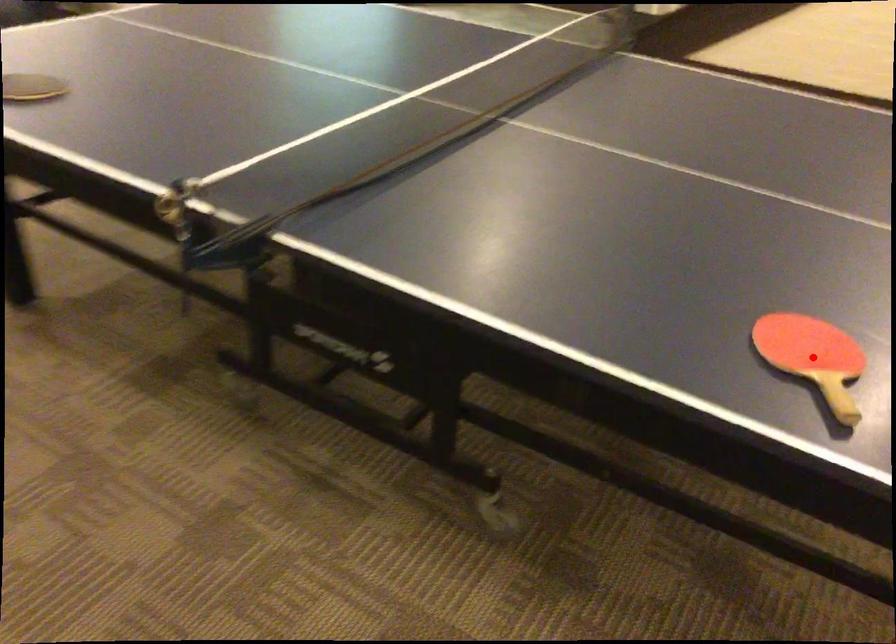
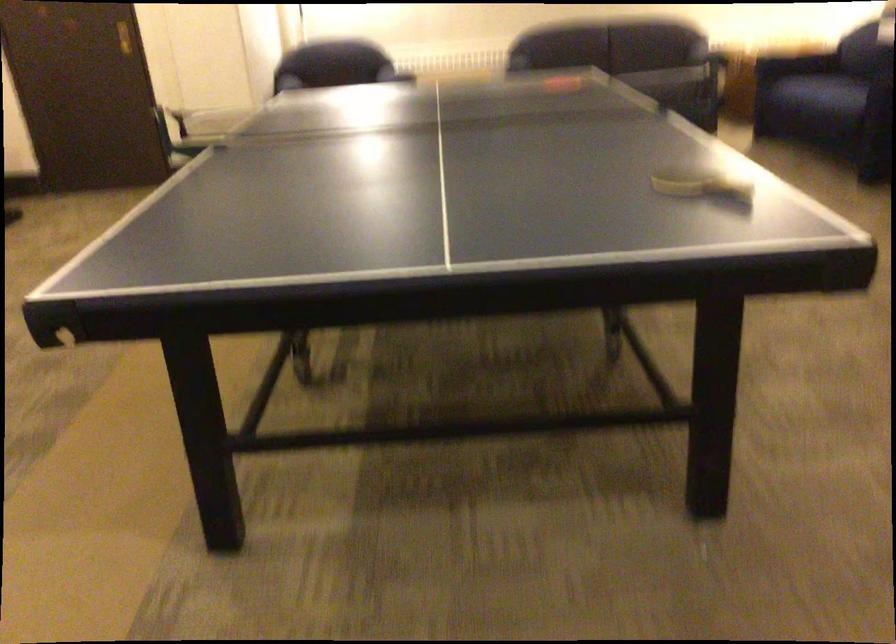
Question: I am providing you with two images of the same scene from different viewpoints. A red point is marked on the first image. At the location where the point appears in image 1, is it still visible in image 2?

Choices:
 (A) Yes
 (B) No

Answer: (B)